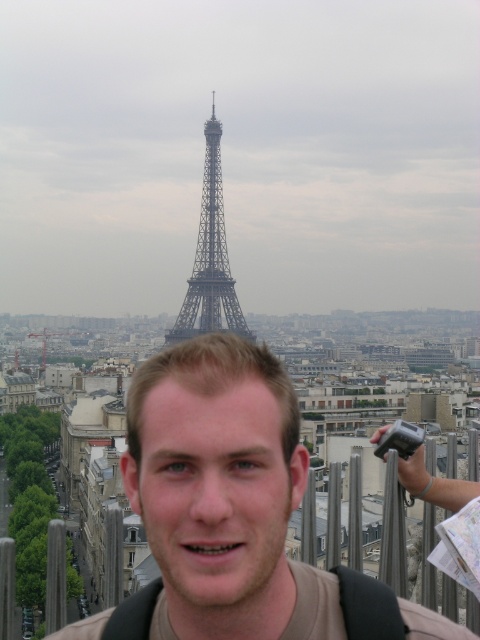
Where is the brown matte shirt at center located in the image?

The brown matte shirt at center is located at point 0.787 on the x axis and 0.456 on the y axis.